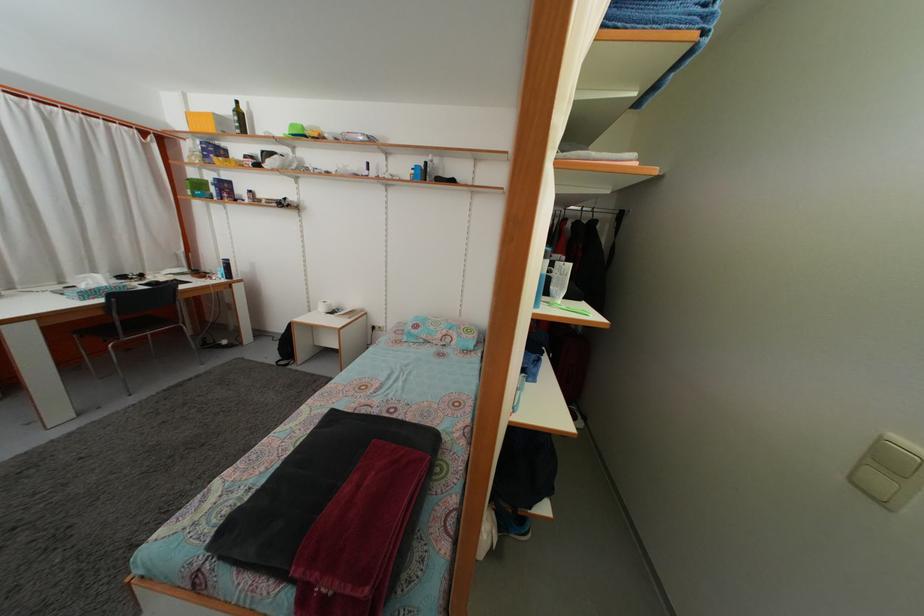
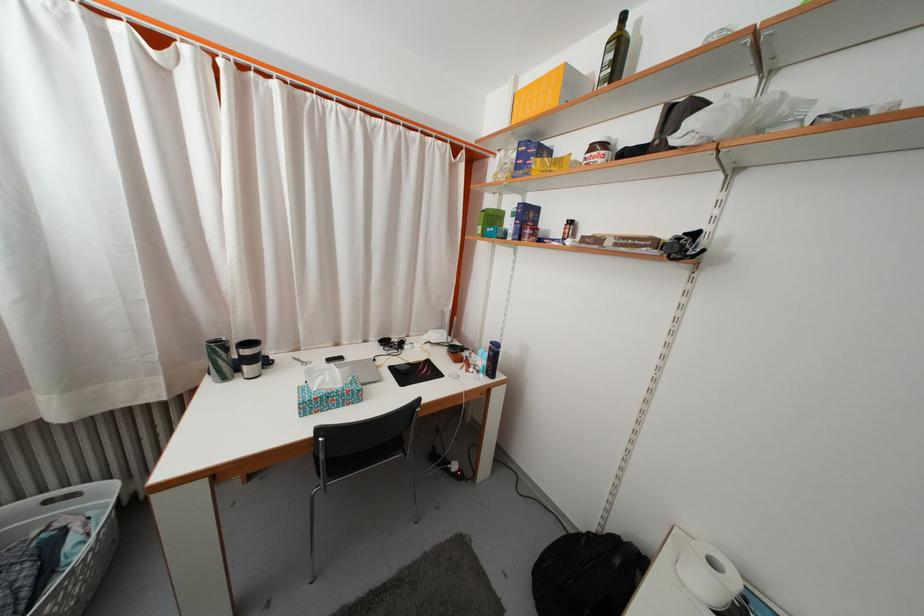
Find the pixel in the second image that matches the point at 205,192 in the first image.

(500, 225)